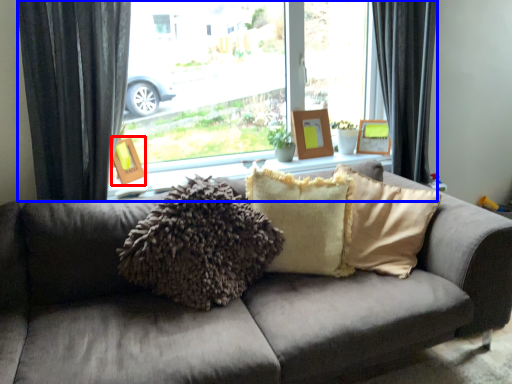
Question: Which object is further to the camera taking this photo, picture frame (highlighted by a red box) or window (highlighted by a blue box)?

Choices:
 (A) picture frame
 (B) window

Answer: (A)